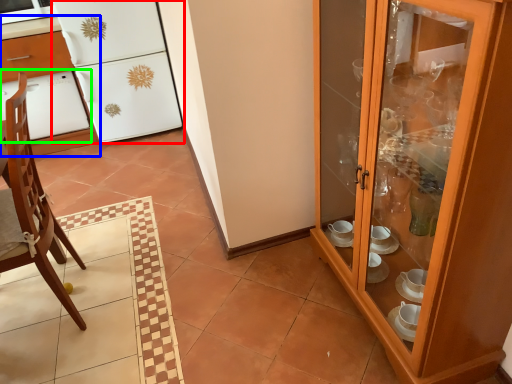
Question: Which object is the farthest from refrigerator (highlighted by a red box)? Choose among these: desk (highlighted by a blue box) or oven (highlighted by a green box).

Choices:
 (A) desk
 (B) oven

Answer: (B)